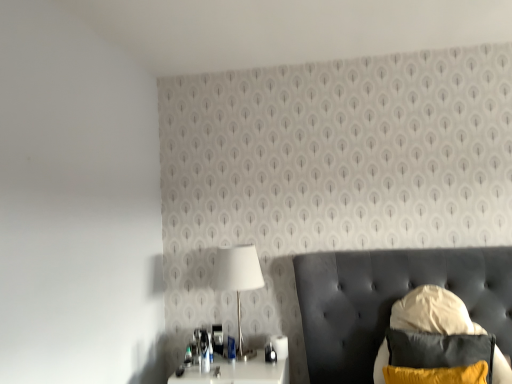
Question: From a real-world perspective, is white glossy nightstand at lower center positioned under velvet black swivel chair at lower right based on gravity?

Choices:
 (A) no
 (B) yes

Answer: (B)

Question: Is white glossy nightstand at lower center taller than velvet black swivel chair at lower right?

Choices:
 (A) no
 (B) yes

Answer: (A)

Question: Are white glossy nightstand at lower center and velvet black swivel chair at lower right beside each other?

Choices:
 (A) no
 (B) yes

Answer: (A)

Question: Does white glossy nightstand at lower center contain velvet black swivel chair at lower right?

Choices:
 (A) yes
 (B) no

Answer: (B)

Question: Is white glossy nightstand at lower center at the left side of velvet black swivel chair at lower right?

Choices:
 (A) yes
 (B) no

Answer: (A)

Question: From the image's perspective, is white glossy nightstand at lower center on top of velvet black swivel chair at lower right?

Choices:
 (A) no
 (B) yes

Answer: (A)

Question: From a real-world perspective, is velvet black swivel chair at lower right physically above white glossy table at lower left?

Choices:
 (A) yes
 (B) no

Answer: (B)

Question: Does velvet black swivel chair at lower right come in front of white glossy table at lower left?

Choices:
 (A) no
 (B) yes

Answer: (A)

Question: Is there a large distance between velvet black swivel chair at lower right and white glossy table at lower left?

Choices:
 (A) yes
 (B) no

Answer: (B)

Question: From a real-world perspective, is velvet black swivel chair at lower right physically below white glossy table at lower left?

Choices:
 (A) no
 (B) yes

Answer: (B)

Question: From the image's perspective, is velvet black swivel chair at lower right beneath white glossy table at lower left?

Choices:
 (A) yes
 (B) no

Answer: (A)

Question: Is velvet black swivel chair at lower right facing towards white glossy table at lower left?

Choices:
 (A) no
 (B) yes

Answer: (B)

Question: Is velvet yellow pillow at lower right turned away from white glossy nightstand at lower center?

Choices:
 (A) yes
 (B) no

Answer: (B)